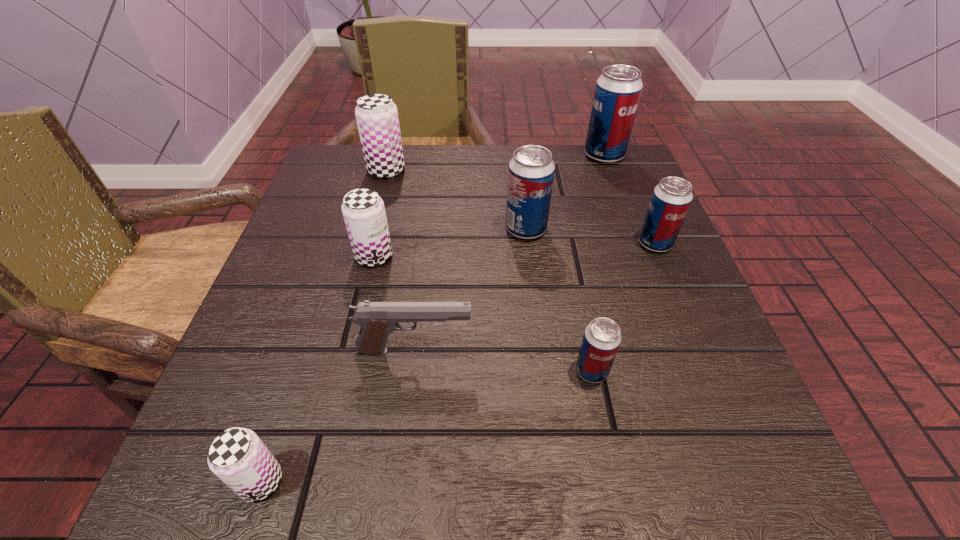
Locate an element on the screen. vacant region between the farthest red beer can and the fifth object from left to right is located at coordinates (565, 192).

You are a GUI agent. You are given a task and a screenshot of the screen. Output one action in this format:
    pyautogui.click(x=<x>, y=<y>)
    Task: Click on the unoccupied position between the third nearest object and the tallest beer can
    The width and height of the screenshot is (960, 540).
    Given the screenshot: What is the action you would take?
    pyautogui.click(x=509, y=253)

Find the location of a particular element. The width and height of the screenshot is (960, 540). vacant area that lies between the smallest purple beer can and the second biggest purple beer can is located at coordinates (318, 369).

Where is `free space between the second smallest red beer can and the nearest beer can`? free space between the second smallest red beer can and the nearest beer can is located at coordinates pos(458,362).

At what (x,y) coordinates should I click in order to perform the action: click on unoccupied position between the second smallest red beer can and the biggest red beer can. Please return your answer as a coordinate pair (x, y). The height and width of the screenshot is (540, 960). Looking at the image, I should click on (630, 199).

This screenshot has width=960, height=540. I want to click on free spot between the smallest purple beer can and the nearest red beer can, so click(x=426, y=426).

The image size is (960, 540). I want to click on vacant area that lies between the smallest red beer can and the third smallest red beer can, so click(559, 300).

At what (x,y) coordinates should I click in order to perform the action: click on free area in between the second smallest purple beer can and the tallest object. Please return your answer as a coordinate pair (x, y). Looking at the image, I should click on (490, 206).

The width and height of the screenshot is (960, 540). In order to click on vacant point located between the smallest purple beer can and the second nearest purple beer can in this screenshot , I will do `click(318, 369)`.

Find the location of `empty space between the second smallest red beer can and the second biggest purple beer can`. empty space between the second smallest red beer can and the second biggest purple beer can is located at coordinates coord(515,250).